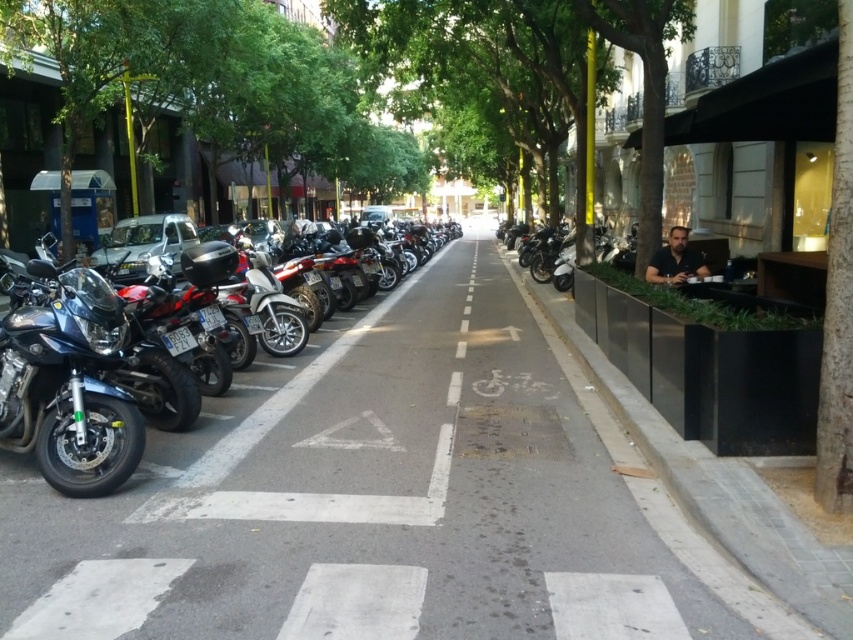
You are a delivery person with a 7.5 feet wide cart. You need to navigate through the street scene described. Can your cart fit between the gray asphalt at center and the green leafy tree at right without touching either?

The distance between the gray asphalt at center and the green leafy tree at right is 8.42 feet, which is wider than your 7.5 feet wide cart. Therefore, your cart can fit between them without touching either.

You are a cyclist planning to ride through the bike lane in the image. The bike lane is on the gray asphalt at center. There is a green leafy tree at right nearby. Considering the space, can you safely ride your bike through the bike lane without hitting the tree?

The gray asphalt at center might be wider than green leafy tree at right, so it is possible that the bike lane has enough width to allow safe passage without hitting the tree. However, since the width comparison is uncertain, caution is advised.

You are standing at the center of the street and want to walk to the gray asphalt at center. Which direction should you move to reach it?

Since you are already at the center of the street, you are already at the gray asphalt at center.